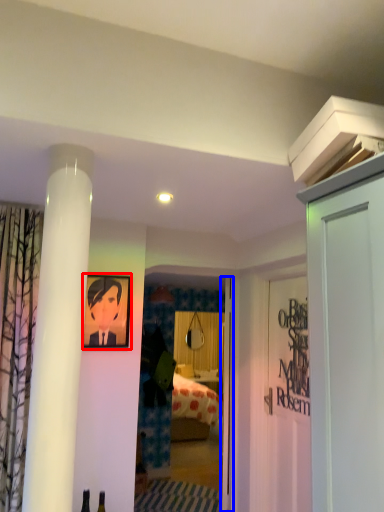
Question: Among these objects, which one is nearest to the camera, picture frame (highlighted by a red box) or door (highlighted by a blue box)?

Choices:
 (A) picture frame
 (B) door

Answer: (A)